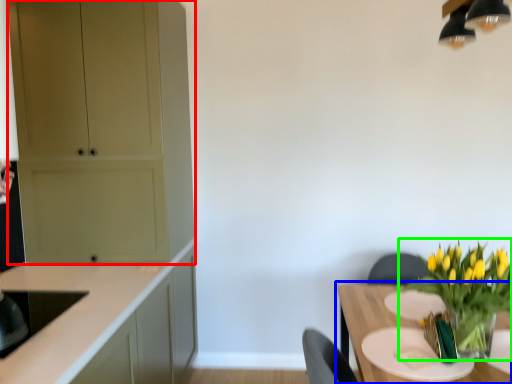
Question: Considering the real-world distances, which object is farthest from cabinetry (highlighted by a red box)? table (highlighted by a blue box) or houseplant (highlighted by a green box)?

Choices:
 (A) table
 (B) houseplant

Answer: (B)